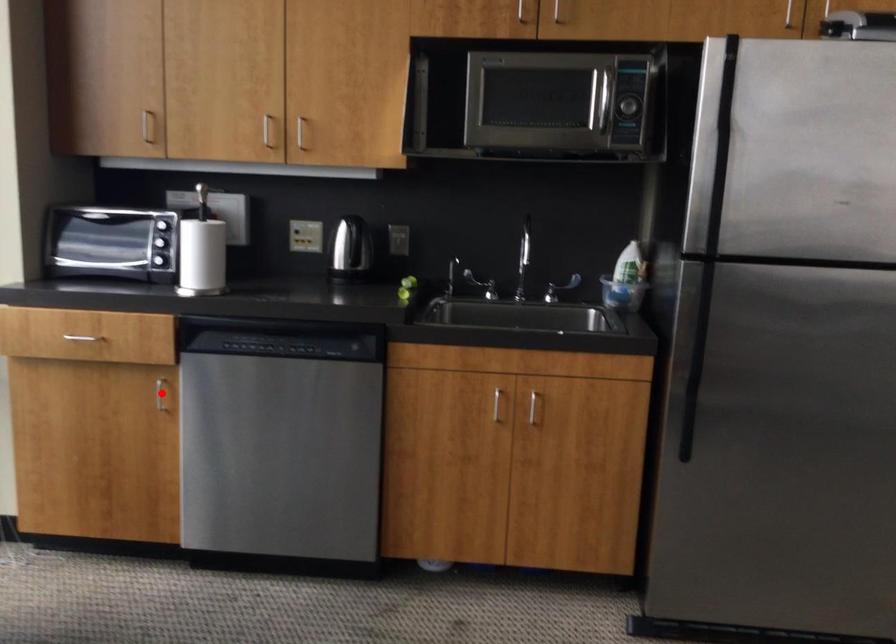
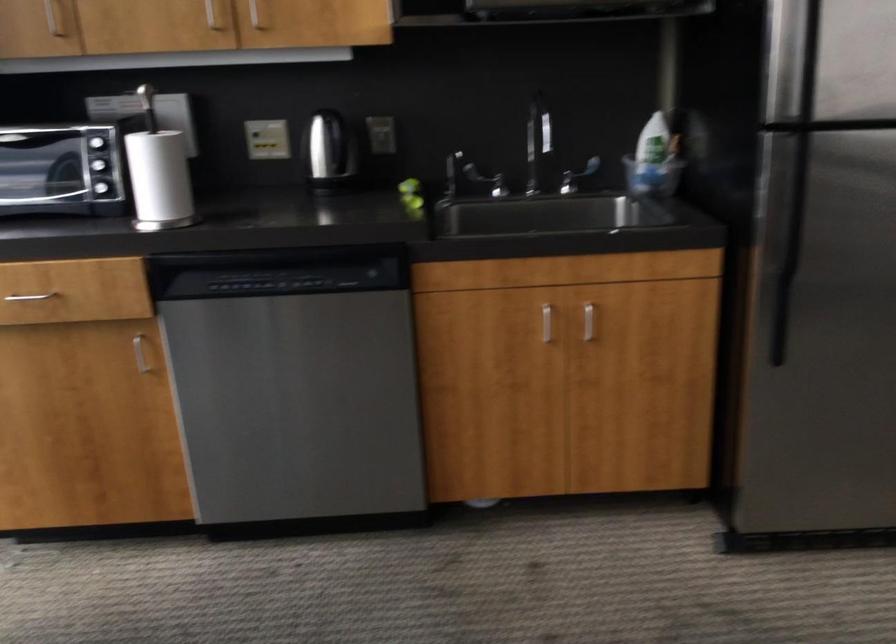
Question: A red point is marked in image1. In image2, is the corresponding 3D point closer to the camera or farther? Reply with the corresponding letter.

Choices:
 (A) The corresponding 3D point is closer.
 (B) The corresponding 3D point is farther.

Answer: (A)